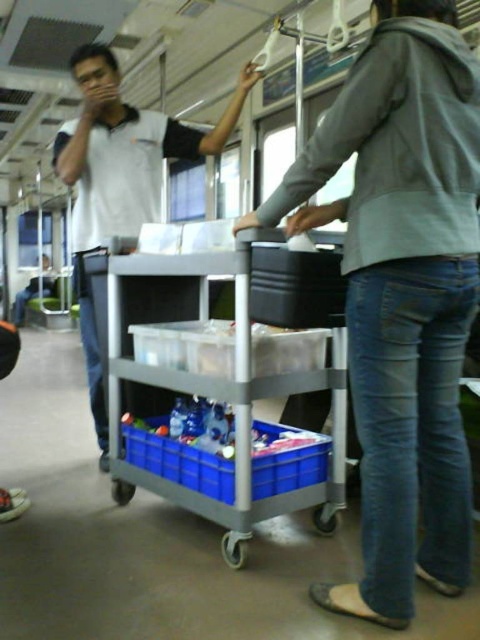
Question: Can you confirm if gray plastic trolley at center is positioned to the right of white matte shirt at upper left?

Choices:
 (A) no
 (B) yes

Answer: (B)

Question: Is gray plastic trolley at center smaller than white matte shirt at upper left?

Choices:
 (A) no
 (B) yes

Answer: (A)

Question: Which point appears farthest from the camera in this image?

Choices:
 (A) (130, 472)
 (B) (106, 86)

Answer: (B)

Question: Is gray plastic trolley at center in front of white matte shirt at upper left?

Choices:
 (A) yes
 (B) no

Answer: (A)